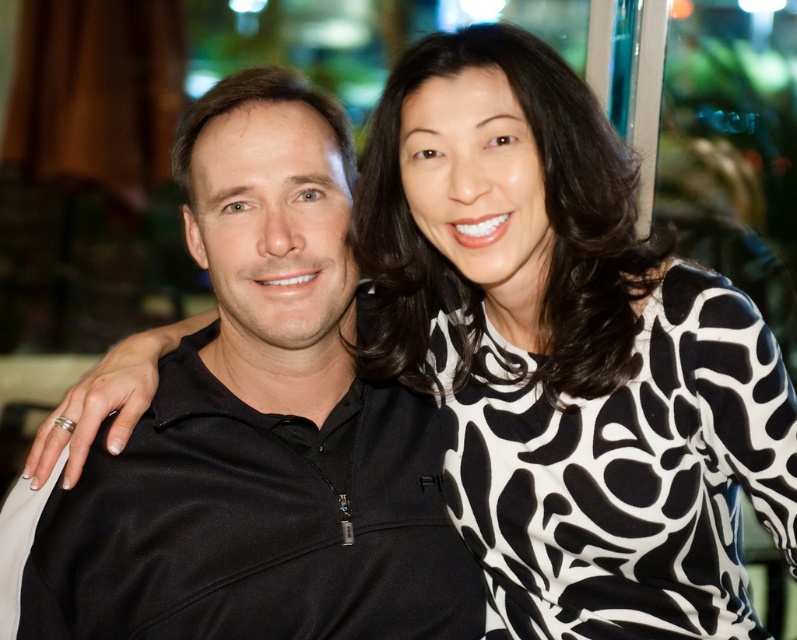
Question: Can you confirm if black and white printed blouse at upper right is bigger than black matte jacket at center?

Choices:
 (A) no
 (B) yes

Answer: (B)

Question: Does black and white printed blouse at upper right lie behind black matte jacket at center?

Choices:
 (A) yes
 (B) no

Answer: (B)

Question: Does black and white printed blouse at upper right appear on the left side of black matte jacket at center?

Choices:
 (A) yes
 (B) no

Answer: (B)

Question: Which point is closer to the camera?

Choices:
 (A) black matte jacket at center
 (B) black and white printed blouse at upper right

Answer: (B)

Question: Which of the following is the farthest from the observer?

Choices:
 (A) black and white printed blouse at upper right
 (B) black matte jacket at center

Answer: (B)